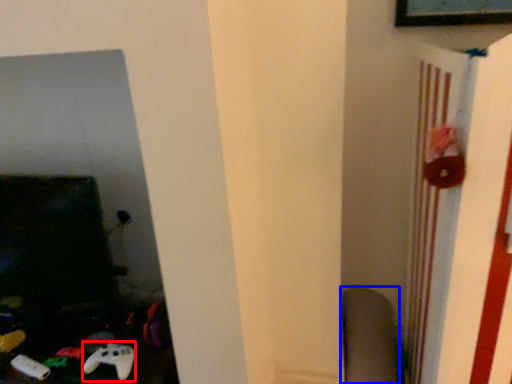
Question: Among these objects, which one is farthest to the camera, game controller (highlighted by a red box) or swivel chair (highlighted by a blue box)?

Choices:
 (A) game controller
 (B) swivel chair

Answer: (B)